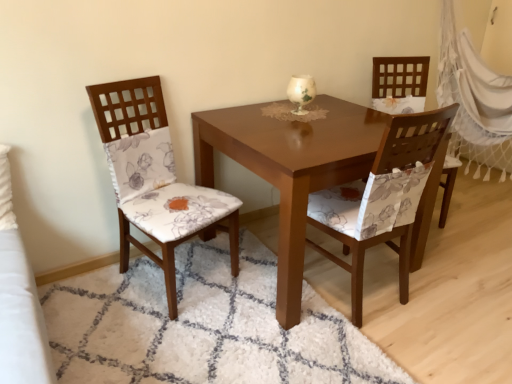
Question: Can you confirm if floral fabric chair at right, which is the 1th chair from right to left, is bigger than wooden chair with floral cushion at left, positioned as the first chair in left-to-right order?

Choices:
 (A) no
 (B) yes

Answer: (A)

Question: Does floral fabric chair at right, which is the 1th chair from right to left, appear on the left side of wooden chair with floral cushion at left, which is counted as the third chair, starting from the right?

Choices:
 (A) yes
 (B) no

Answer: (B)

Question: From a real-world perspective, is floral fabric chair at right, placed as the 3th chair when sorted from left to right, over wooden chair with floral cushion at left, which is counted as the third chair, starting from the right?

Choices:
 (A) no
 (B) yes

Answer: (A)

Question: Is floral fabric chair at right, placed as the 3th chair when sorted from left to right, not near wooden chair with floral cushion at left, positioned as the first chair in left-to-right order?

Choices:
 (A) no
 (B) yes

Answer: (B)

Question: Does floral fabric chair at right, which is the 1th chair from right to left, have a greater height compared to wooden chair with floral cushion at left, positioned as the first chair in left-to-right order?

Choices:
 (A) no
 (B) yes

Answer: (B)

Question: Visually, is white shaggy rug at center positioned to the left or to the right of white net curtain at right?

Choices:
 (A) right
 (B) left

Answer: (B)

Question: From the image's perspective, is white shaggy rug at center located above or below white net curtain at right?

Choices:
 (A) above
 (B) below

Answer: (B)

Question: Would you say white shaggy rug at center is inside or outside white net curtain at right?

Choices:
 (A) inside
 (B) outside

Answer: (B)

Question: Considering the positions of point (225, 349) and point (462, 140), is point (225, 349) closer or farther from the camera than point (462, 140)?

Choices:
 (A) farther
 (B) closer

Answer: (B)

Question: From a real-world perspective, is white net curtain at right positioned above or below white shaggy rug at center?

Choices:
 (A) above
 (B) below

Answer: (A)

Question: Considering the positions of white net curtain at right and white shaggy rug at center in the image, is white net curtain at right taller or shorter than white shaggy rug at center?

Choices:
 (A) tall
 (B) short

Answer: (A)

Question: Is white net curtain at right bigger or smaller than white shaggy rug at center?

Choices:
 (A) small
 (B) big

Answer: (B)

Question: Which is correct: white net curtain at right is inside white shaggy rug at center, or outside of it?

Choices:
 (A) outside
 (B) inside

Answer: (A)

Question: In terms of size, does white net curtain at right appear bigger or smaller than matte floral fabric chair at center, which is the second chair in right-to-left order?

Choices:
 (A) small
 (B) big

Answer: (B)

Question: From a real-world perspective, is white net curtain at right above or below matte floral fabric chair at center, placed as the 2th chair when sorted from left to right?

Choices:
 (A) above
 (B) below

Answer: (A)